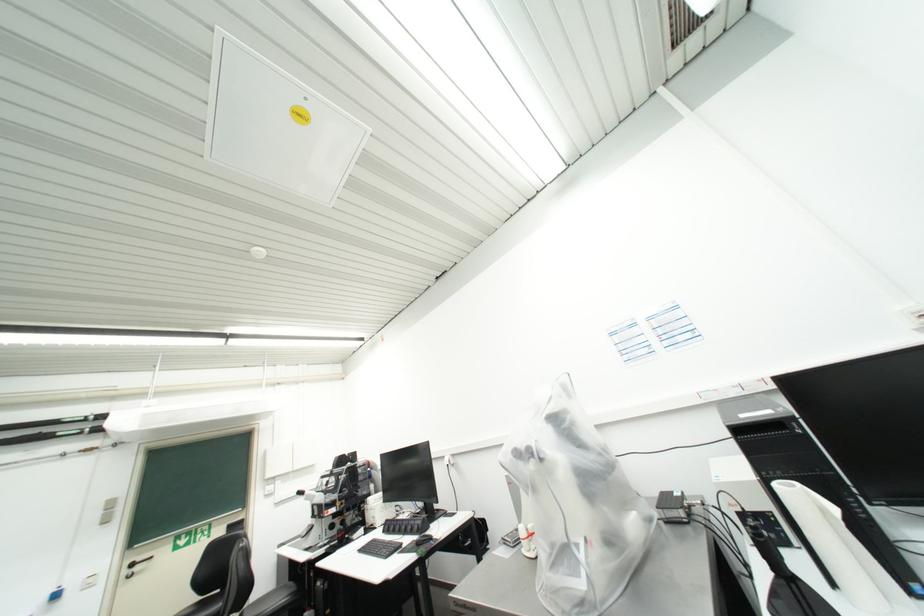
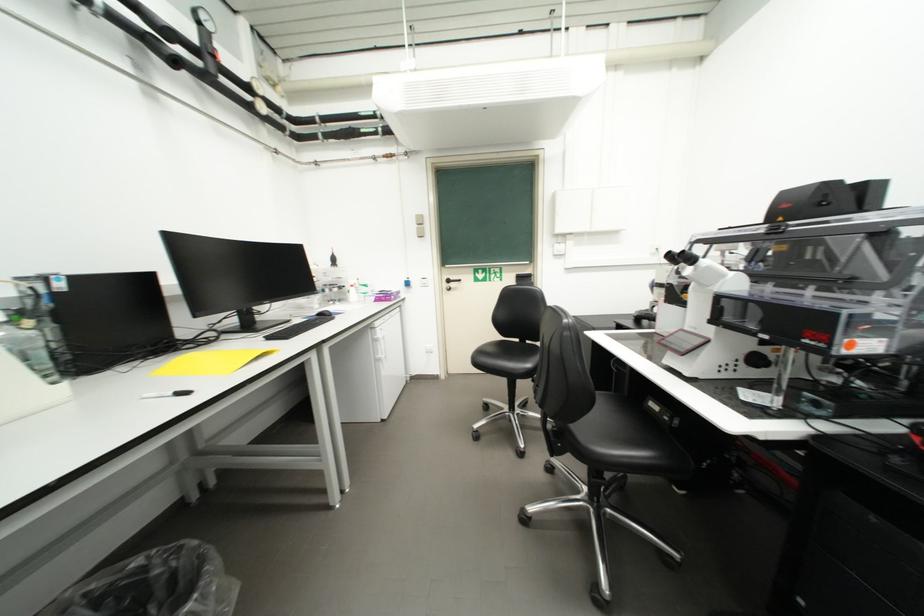
The point at (264, 493) is marked in the first image. Where is the corresponding point in the second image?

(553, 249)